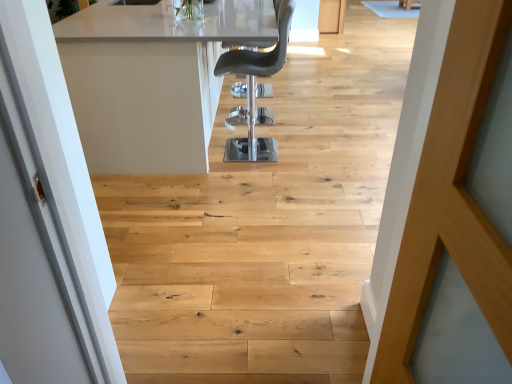
The width and height of the screenshot is (512, 384). Find the location of `black leather chair at center`. black leather chair at center is located at coordinates (x=254, y=87).

What do you see at coordinates (254, 87) in the screenshot? The image size is (512, 384). I see `black leather chair at center` at bounding box center [254, 87].

Describe the element at coordinates (152, 80) in the screenshot. I see `white glossy table at center` at that location.

Image resolution: width=512 pixels, height=384 pixels. Identify the location of white glossy table at center. (152, 80).

At what (x,y) coordinates should I click in order to perform the action: click on black leather chair at center. Please return your answer as a coordinate pair (x, y). This screenshot has height=384, width=512. Looking at the image, I should click on (254, 87).

Considering the relative positions of black leather chair at center and white glossy table at center in the image provided, is black leather chair at center to the right of white glossy table at center from the viewer's perspective?

Indeed, black leather chair at center is positioned on the right side of white glossy table at center.

Is black leather chair at center closer to the viewer compared to white glossy table at center?

That is False.

Which point is more distant from viewer, (217, 72) or (93, 41)?

The point (217, 72) is farther from the camera.

From the image's perspective, is black leather chair at center beneath white glossy table at center?

Indeed, from the image's perspective, black leather chair at center is shown beneath white glossy table at center.

From a real-world perspective, is black leather chair at center positioned above or below white glossy table at center?

In terms of real-world spatial position, black leather chair at center is above white glossy table at center.

Consider the image. Is black leather chair at center wider than white glossy table at center?

Incorrect, the width of black leather chair at center does not surpass that of white glossy table at center.

Consider the image. Does black leather chair at center have a greater height compared to white glossy table at center?

Indeed, black leather chair at center has a greater height compared to white glossy table at center.

Who is smaller, black leather chair at center or white glossy table at center?

black leather chair at center.

Choose the correct answer: Is black leather chair at center inside white glossy table at center or outside it?

black leather chair at center fits inside white glossy table at center.

Is black leather chair at center next to white glossy table at center and touching it?

No, black leather chair at center is not making contact with white glossy table at center.

Consider the image. Could you tell me if black leather chair at center is facing white glossy table at center?

Yes, black leather chair at center is facing white glossy table at center.

Identify the location of chair located on the right of white glossy table at center. (254, 87).

Considering the positions of objects white glossy table at center and black leather chair at center in the image provided, who is more to the right, white glossy table at center or black leather chair at center?

Positioned to the right is black leather chair at center.

Is the position of white glossy table at center more distant than that of black leather chair at center?

No, white glossy table at center is closer to the camera.

Is point (152, 46) closer or farther from the camera than point (260, 71)?

Point (152, 46).

From the image's perspective, between white glossy table at center and black leather chair at center, which one is located above?

white glossy table at center appears higher in the image.

From a real-world perspective, is white glossy table at center positioned under black leather chair at center based on gravity?

Indeed, from a real-world perspective, white glossy table at center is positioned beneath black leather chair at center.

Is white glossy table at center thinner than black leather chair at center?

No.

Who is shorter, white glossy table at center or black leather chair at center?

white glossy table at center.

Considering the sizes of white glossy table at center and black leather chair at center in the image, is white glossy table at center bigger or smaller than black leather chair at center?

white glossy table at center is bigger than black leather chair at center.

Is white glossy table at center spatially inside black leather chair at center, or outside of it?

white glossy table at center exists outside the volume of black leather chair at center.

Are white glossy table at center and black leather chair at center located far from each other?

No, white glossy table at center is not far away from black leather chair at center.

Is white glossy table at center facing towards black leather chair at center?

Yes, white glossy table at center is turned towards black leather chair at center.

How many degrees apart are the facing directions of white glossy table at center and black leather chair at center?

The angle between the facing direction of white glossy table at center and the facing direction of black leather chair at center is 180 degrees.

Where is `table that appears in front of the black leather chair at center`? The image size is (512, 384). table that appears in front of the black leather chair at center is located at coordinates (152, 80).

You are a GUI agent. You are given a task and a screenshot of the screen. Output one action in this format:
    pyautogui.click(x=<x>, y=<y>)
    Task: Click on the chair behind the white glossy table at center
    
    Given the screenshot: What is the action you would take?
    pyautogui.click(x=254, y=87)

Image resolution: width=512 pixels, height=384 pixels. Identify the location of chair above the white glossy table at center (from a real-world perspective). (254, 87).